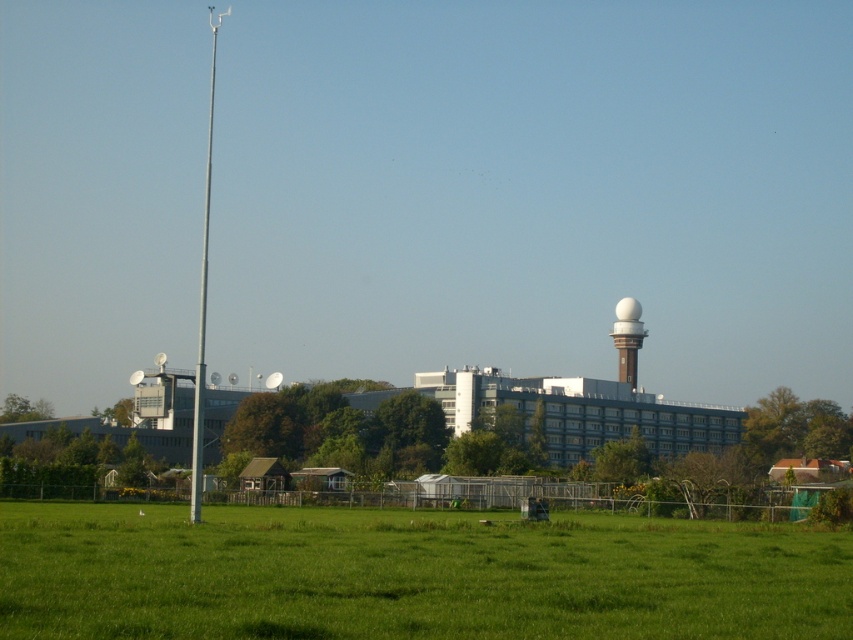
Question: Which object is farther from the camera taking this photo?

Choices:
 (A) white glossy water tower at upper center
 (B) silver metallic pole at left

Answer: (A)

Question: Which of the following is the farthest from the observer?

Choices:
 (A) (202, 444)
 (B) (839, 541)

Answer: (A)

Question: Estimate the real-world distances between objects in this image. Which object is farther from the green grass at lower center?

Choices:
 (A) silver metallic pole at left
 (B) white glossy water tower at upper center

Answer: (B)

Question: Observing the image, what is the correct spatial positioning of green grass at lower center in reference to white glossy water tower at upper center?

Choices:
 (A) above
 (B) below

Answer: (B)

Question: Is green grass at lower center thinner than silver metallic pole at left?

Choices:
 (A) yes
 (B) no

Answer: (A)

Question: Is green grass at lower center further to the viewer compared to white glossy water tower at upper center?

Choices:
 (A) no
 (B) yes

Answer: (A)